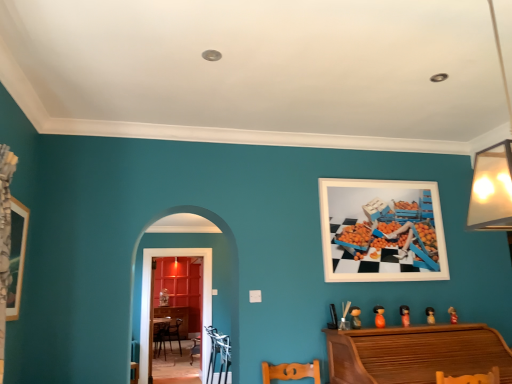
Question: Considering the positions of white matte picture frame at upper right, arranged as the first picture frame when viewed from the back, and wooden picture frame at left, the 2th picture frame from the back, in the image, is white matte picture frame at upper right, arranged as the first picture frame when viewed from the back, wider or thinner than wooden picture frame at left, the 2th picture frame from the back,?

Choices:
 (A) thin
 (B) wide

Answer: (A)

Question: Does point (359, 228) appear closer or farther from the camera than point (22, 244)?

Choices:
 (A) farther
 (B) closer

Answer: (A)

Question: Which of these objects is positioned closest to the orange matte toy at lower right, the 2th toy viewed from the left?

Choices:
 (A) wooden table at center
 (B) orange matte doll at lower right, which is counted as the third toy, starting from the left
 (C) metallic silver armchair at lower center
 (D) wooden picture frame at left, acting as the second picture frame starting from the right
 (E) wooden dresser at center

Answer: (B)

Question: Which object is the closest to the matte orange figurine at lower right, the 2th toy viewed from the right?

Choices:
 (A) wooden table at center
 (B) matte orange figurine at lower right, the 5th toy when ordered from left to right
 (C) wooden dresser at center
 (D) matte wooden doll at lower center, arranged as the 5th toy when viewed from the right
 (E) orange matte doll at lower right, which is counted as the third toy, starting from the left

Answer: (B)